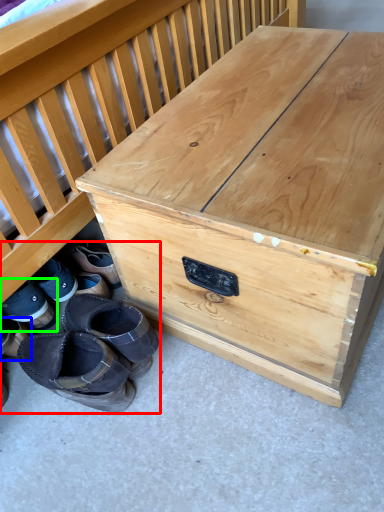
Question: Which object is the farthest from footwear (highlighted by a red box)? Choose among these: footwear (highlighted by a blue box) or footwear (highlighted by a green box).

Choices:
 (A) footwear
 (B) footwear

Answer: (A)